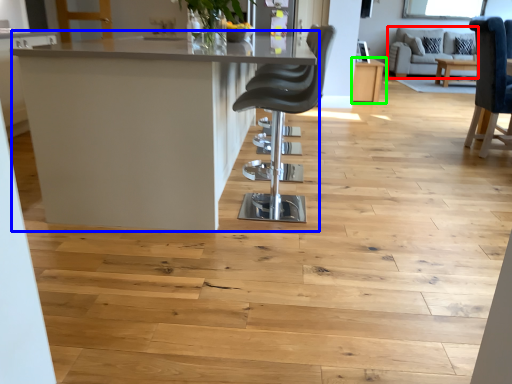
Question: Based on their relative distances, which object is nearer to couch (highlighted by a red box)? Choose from table (highlighted by a blue box) and table (highlighted by a green box).

Choices:
 (A) table
 (B) table

Answer: (B)